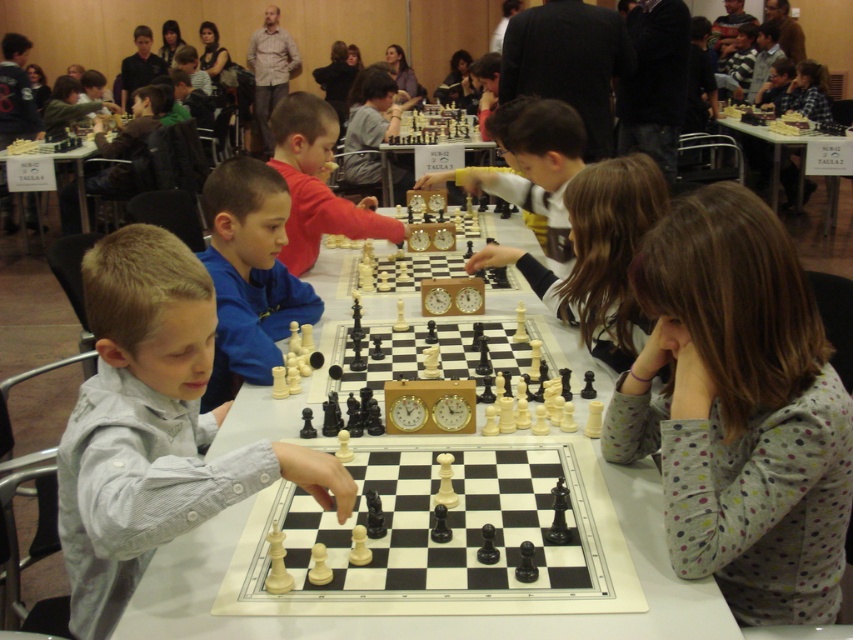
Is point (259, 177) positioned behind point (76, 161)?

No, (259, 177) is closer to viewer.

Does blue fabric shirt at center have a lesser height compared to white plastic chessboard at left?

Correct, blue fabric shirt at center is not as tall as white plastic chessboard at left.

Image resolution: width=853 pixels, height=640 pixels. Describe the element at coordinates (248, 275) in the screenshot. I see `blue fabric shirt at center` at that location.

The image size is (853, 640). Identify the location of blue fabric shirt at center. (248, 275).

Is gray striped shirt at center bigger than blue fabric shirt at center?

Yes.

This screenshot has height=640, width=853. Describe the element at coordinates (154, 426) in the screenshot. I see `gray striped shirt at center` at that location.

Where is `gray striped shirt at center`? This screenshot has height=640, width=853. gray striped shirt at center is located at coordinates (154, 426).

What do you see at coordinates (154, 426) in the screenshot? I see `gray striped shirt at center` at bounding box center [154, 426].

You are a GUI agent. You are given a task and a screenshot of the screen. Output one action in this format:
    pyautogui.click(x=<x>, y=<y>)
    Task: Click on the gray striped shirt at center
    The height and width of the screenshot is (640, 853).
    Given the screenshot: What is the action you would take?
    pyautogui.click(x=154, y=426)